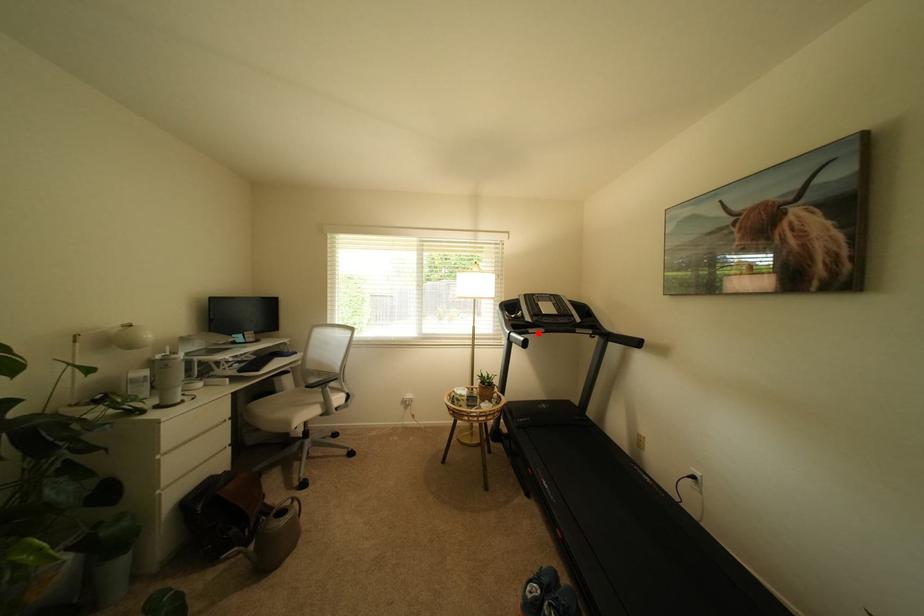
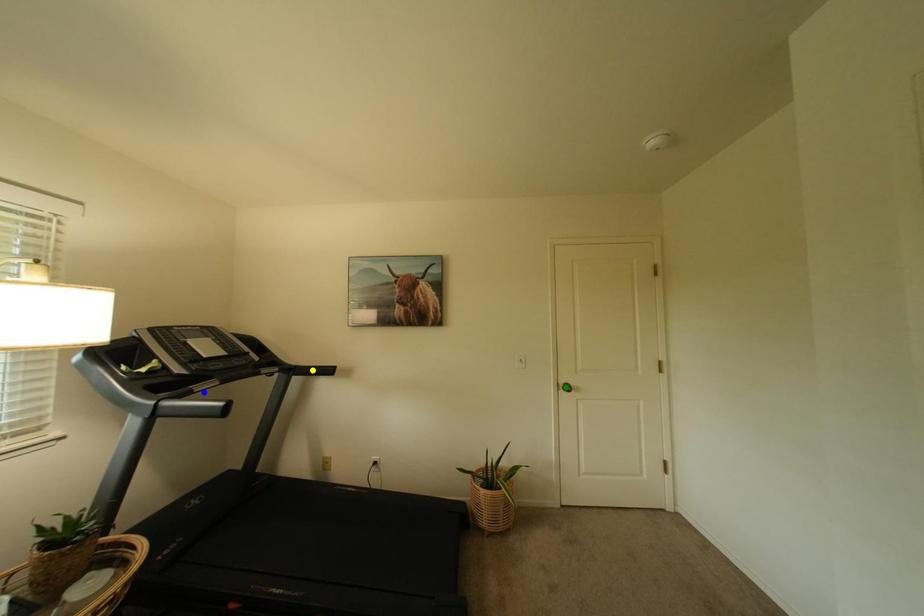
Question: I am providing you with two images of the same scene from different viewpoints. A red point is marked on the first image. You are given multiple points on the second image. In image 2, which mark is for the same physical point as the one in image 1?

Choices:
 (A) blue point
 (B) green point
 (C) yellow point

Answer: (A)